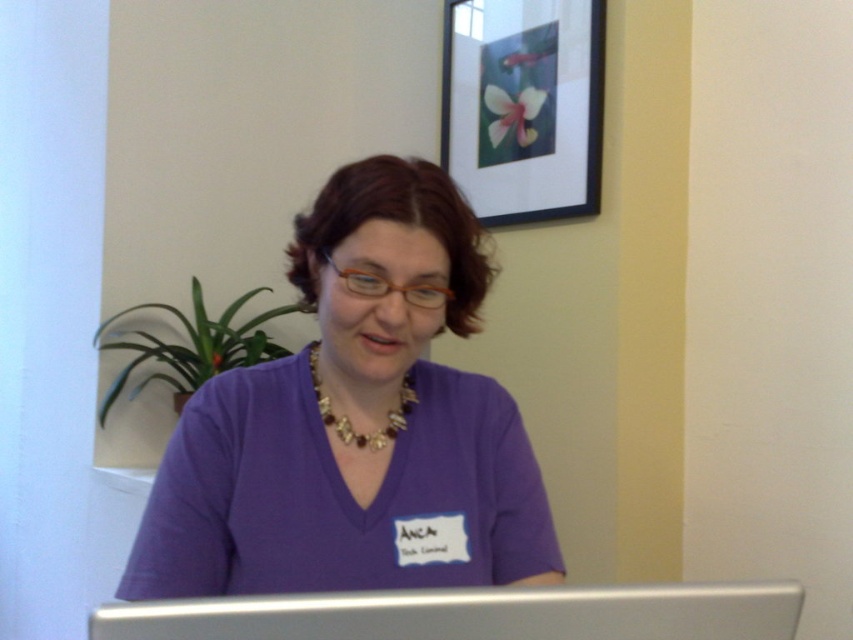
Is point (351, 342) more distant than point (338, 595)?

Yes, point (351, 342) is farther from viewer.

From the picture: Which of these two, purple fabric shirt at center or silver metallic laptop at center, stands taller?

Standing taller between the two is purple fabric shirt at center.

In order to click on purple fabric shirt at center in this screenshot , I will do `click(355, 422)`.

Identify the location of purple fabric shirt at center. This screenshot has width=853, height=640. (355, 422).

This screenshot has height=640, width=853. What do you see at coordinates (473, 614) in the screenshot?
I see `silver metallic laptop at center` at bounding box center [473, 614].

Who is taller, silver metallic laptop at center or gold/beaded necklace at center?

Standing taller between the two is gold/beaded necklace at center.

Measure the distance between silver metallic laptop at center and camera.

silver metallic laptop at center and camera are 65.14 centimeters apart.

Where is `silver metallic laptop at center`? The width and height of the screenshot is (853, 640). silver metallic laptop at center is located at coordinates point(473,614).

Who is taller, purple fabric shirt at center or black matte picture frame at upper center?

black matte picture frame at upper center

Which is behind, point (390, 396) or point (454, 16)?

Positioned behind is point (454, 16).

Locate an element on the screen. purple fabric shirt at center is located at coordinates (355, 422).